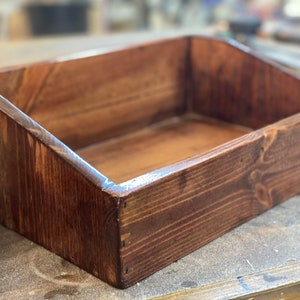
Identify the location of front left corner of wooden box. This screenshot has height=300, width=300. (120, 198).